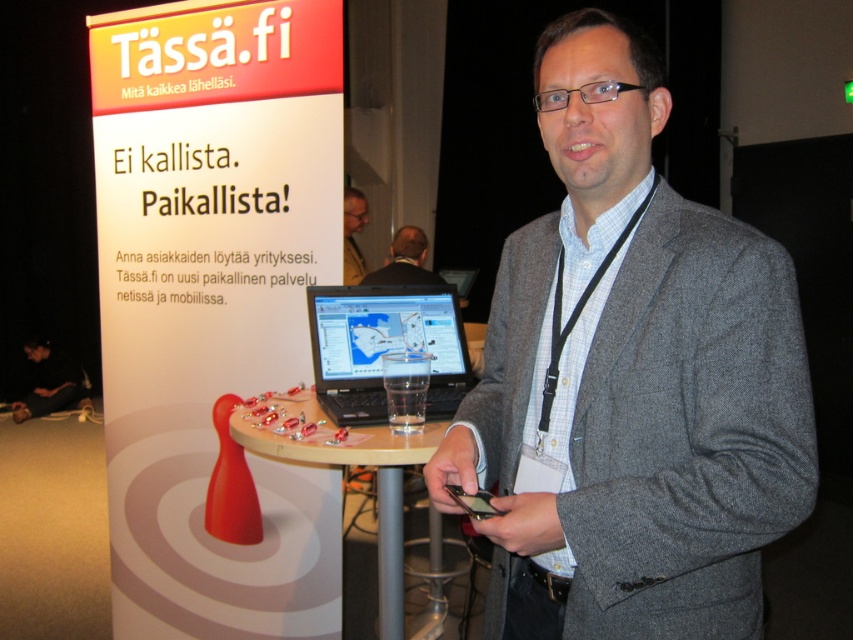
You are attending a conference and need to place a name tag on either the gray woolen suit at center or the black plastic laptop at center. Based on their positions, which object is located to the right of the other?

The gray woolen suit at center is to the right of the black plastic laptop at center.

You are at a conference and need to place a 10cm thick document on the smooth wooden table at center. Can the table support the document based on its thickness compared to the black leather jacket at lower left?

The smooth wooden table at center is thinner than the black leather jacket at lower left, so it may not be able to support the 10cm thick document as its thickness is less than the jacket. However, tables are generally designed to support weight regardless of their thickness, so this comparison might not be relevant. Please check the table for sturdiness or consult event staff for assistance.

You are a photographer at the event and want to take a portrait of the man while ensuring the laptop remains visible in the background. Given their positions, can you frame the shot so that both the gray woolen suit at center and the black plastic laptop at center are clearly visible?

The gray woolen suit at center is above the black plastic laptop at center, so if you position the camera to capture the man in the foreground, the laptop will naturally be visible below him in the background. This arrangement allows both elements to be clearly seen in the frame.